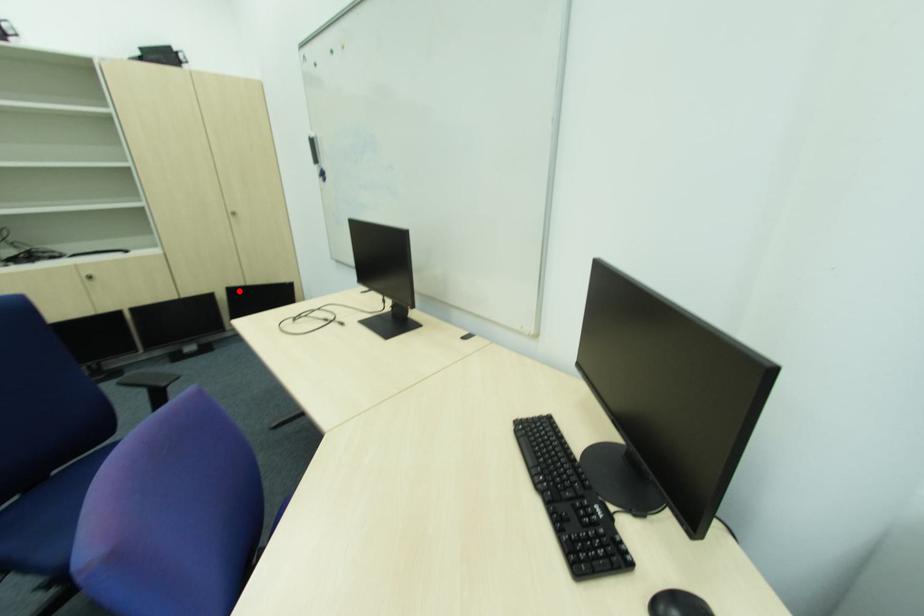
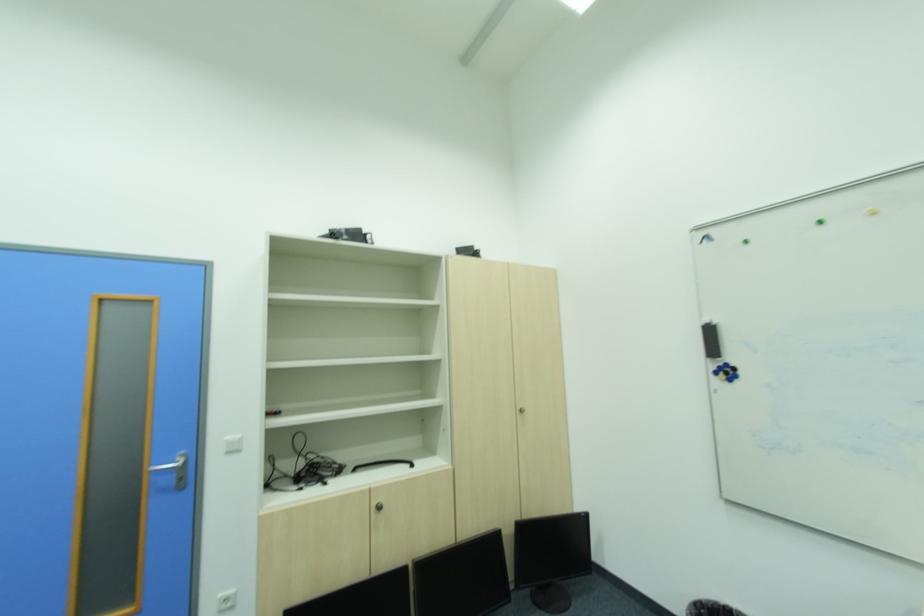
Question: A red point is marked in image1. In image2, is the corresponding 3D point closer to the camera or farther? Reply with the corresponding letter.

Choices:
 (A) The corresponding 3D point is closer.
 (B) The corresponding 3D point is farther.

Answer: (B)